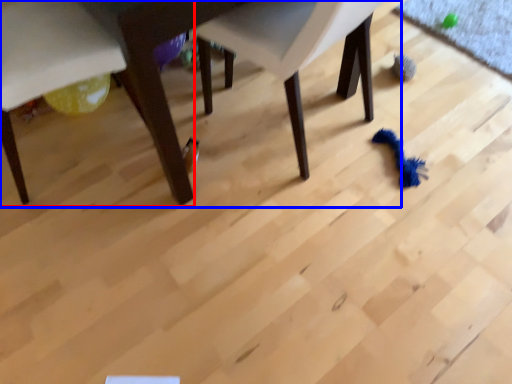
Question: Among these objects, which one is farthest to the camera, chair (highlighted by a red box) or table (highlighted by a blue box)?

Choices:
 (A) chair
 (B) table

Answer: (A)